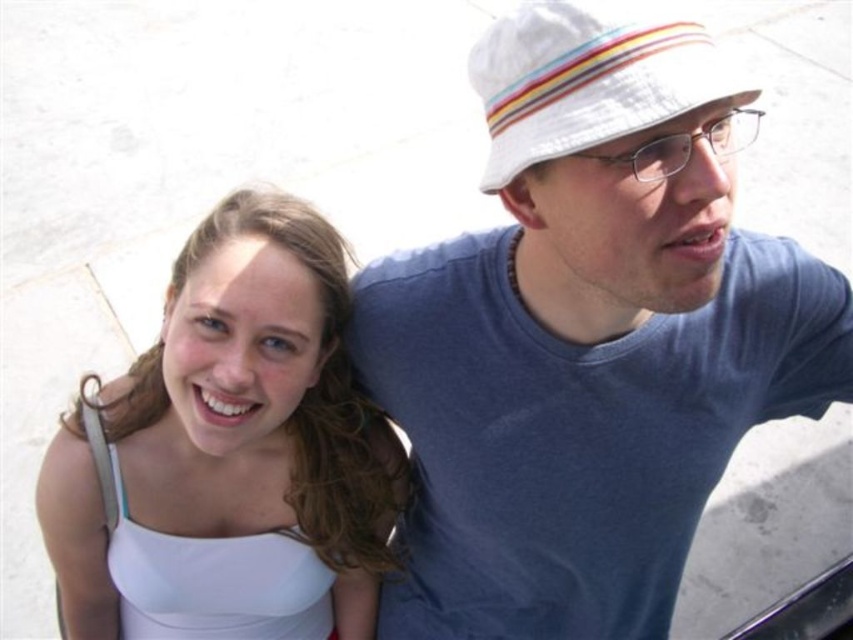
Question: Which point appears farthest from the camera in this image?

Choices:
 (A) (583, 125)
 (B) (224, 241)
 (C) (724, 131)
 (D) (711, 488)

Answer: (D)

Question: Where is white matte tank top at left located in relation to white striped fabric hat at upper right in the image?

Choices:
 (A) above
 (B) below

Answer: (B)

Question: Is the position of white cotton shirt at upper right less distant than that of clear plastic glasses at upper right?

Choices:
 (A) no
 (B) yes

Answer: (B)

Question: Can you confirm if white cotton shirt at upper right is positioned to the left of white striped fabric hat at upper right?

Choices:
 (A) yes
 (B) no

Answer: (B)

Question: Which point appears farthest from the camera in this image?

Choices:
 (A) (251, 464)
 (B) (700, 140)
 (C) (699, 134)
 (D) (636, 52)

Answer: (A)

Question: Which object appears closest to the camera in this image?

Choices:
 (A) white striped fabric hat at upper right
 (B) white cotton shirt at upper right
 (C) white matte tank top at left

Answer: (B)